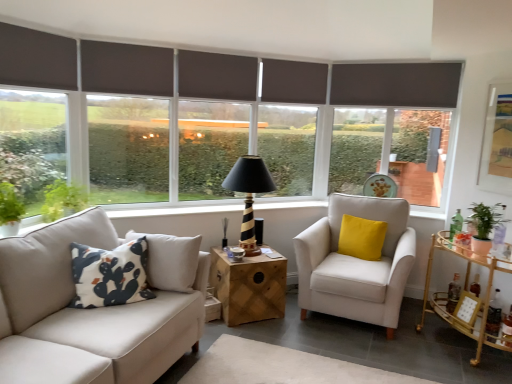
Measure the distance between point (316, 89) and camera.

Point (316, 89) is 4.07 meters away from camera.

Where is `black striped wood table lamp at center`? This screenshot has width=512, height=384. black striped wood table lamp at center is located at coordinates (249, 194).

How much space does matte gray roller blind at center, the fourth window in the left-to-right sequence, occupy vertically?

The height of matte gray roller blind at center, the fourth window in the left-to-right sequence, is 4.42 feet.

The width and height of the screenshot is (512, 384). What are the coordinates of `dark gray matte shutter at upper center, acting as the 1th shutter starting from the right` in the screenshot? It's located at (294, 82).

Is dark gray roller blind at left, the 2th window from the left, inside or outside of dark gray matte shutter at upper center, the 4th shutter when ordered from front to back?

dark gray roller blind at left, the 2th window from the left, cannot be found inside dark gray matte shutter at upper center, the 4th shutter when ordered from front to back.

From a real-world perspective, between dark gray roller blind at left, the third window positioned from the right, and dark gray matte shutter at upper center, the 4th shutter when ordered from front to back, who is vertically lower?

dark gray roller blind at left, the third window positioned from the right, is physically lower.

Does dark gray roller blind at left, the 2th window from the left, have a greater height compared to dark gray matte shutter at upper center, acting as the 1th shutter starting from the back?

Yes.

From the image's perspective, is dark gray roller blind at left, the third window positioned from the right, located beneath dark gray matte shutter at upper center, the 4th shutter when ordered from front to back?

Correct, dark gray roller blind at left, the third window positioned from the right, appears lower than dark gray matte shutter at upper center, the 4th shutter when ordered from front to back, in the image.

From the picture: How much distance is there between beige fabric armchair at center and matte gray roller blind at center, acting as the first window starting from the right?

beige fabric armchair at center is 1.49 meters from matte gray roller blind at center, acting as the first window starting from the right.

How different are the orientations of beige fabric armchair at center and matte gray roller blind at center, the fourth window in the left-to-right sequence, in degrees?

The angle between the facing direction of beige fabric armchair at center and the facing direction of matte gray roller blind at center, the fourth window in the left-to-right sequence, is 46 degrees.

Find the location of a particular element. This screenshot has height=384, width=512. chair lying in front of the matte gray roller blind at center, the fourth window in the left-to-right sequence is located at coordinates (356, 263).

From the image's perspective, which is above, beige fabric armchair at center or matte gray roller blind at center, the fourth window in the left-to-right sequence?

matte gray roller blind at center, the fourth window in the left-to-right sequence, from the image's perspective.

Who is taller, beige fabric armchair at center or dark gray matte shutter at upper center, the 4th shutter when ordered from front to back?

beige fabric armchair at center is taller.

How distant is beige fabric armchair at center from dark gray matte shutter at upper center, the 4th shutter when ordered from front to back?

They are 1.41 meters apart.

Who is more distant, beige fabric armchair at center or dark gray matte shutter at upper center, the 4th shutter when ordered from front to back?

dark gray matte shutter at upper center, the 4th shutter when ordered from front to back, is behind.

In terms of width, does beige fabric armchair at center look wider or thinner when compared to dark gray matte shutter at upper center, acting as the 1th shutter starting from the back?

Clearly, beige fabric armchair at center has more width compared to dark gray matte shutter at upper center, acting as the 1th shutter starting from the back.

How many degrees apart are the facing directions of dark gray printed cushion at left, marked as the 1th pillow in a left-to-right arrangement, and matte gray roller blind at center, the fourth window in the left-to-right sequence?

The angle between the facing direction of dark gray printed cushion at left, marked as the 1th pillow in a left-to-right arrangement, and the facing direction of matte gray roller blind at center, the fourth window in the left-to-right sequence, is 6.61 degrees.

Is dark gray printed cushion at left, marked as the 1th pillow in a left-to-right arrangement, facing away from matte gray roller blind at center, acting as the first window starting from the right?

No.

Starting from the dark gray printed cushion at left, which ranks as the 2th pillow in right-to-left order, which window is the 2nd one to the right? Please provide its 2D coordinates.

[(288, 147)]

Is dark gray printed cushion at left, which is counted as the second pillow, starting from the back, to the right of matte gray roller blind at center, the fourth window in the left-to-right sequence, from the viewer's perspective?

No, dark gray printed cushion at left, which is counted as the second pillow, starting from the back, is not to the right of matte gray roller blind at center, the fourth window in the left-to-right sequence.

Does beige fabric armchair at center appear on the left side of dark gray matte shutter at upper center, marked as the second shutter in a left-to-right arrangement?

No.

From the image's perspective, would you say beige fabric armchair at center is positioned over dark gray matte shutter at upper center, the 2th shutter positioned from the front?

No, from the image's perspective, beige fabric armchair at center is not on top of dark gray matte shutter at upper center, the 2th shutter positioned from the front.

From the picture: Could you tell me if beige fabric armchair at center is facing dark gray matte shutter at upper center, marked as the second shutter in a left-to-right arrangement?

No, beige fabric armchair at center is not aimed at dark gray matte shutter at upper center, marked as the second shutter in a left-to-right arrangement.

From a real-world perspective, is black striped wood table lamp at center below dark gray matte shutter at upper center, acting as the 1th shutter starting from the right?

Yes, from a real-world perspective, black striped wood table lamp at center is under dark gray matte shutter at upper center, acting as the 1th shutter starting from the right.

Looking at this image, could dark gray matte shutter at upper center, the 4th shutter when ordered from front to back, be considered to be inside black striped wood table lamp at center?

Definitely not — dark gray matte shutter at upper center, the 4th shutter when ordered from front to back, is not inside black striped wood table lamp at center.

Based on their positions, is black striped wood table lamp at center located to the left or right of dark gray matte shutter at upper center, acting as the 1th shutter starting from the back?

black striped wood table lamp at center is to the left of dark gray matte shutter at upper center, acting as the 1th shutter starting from the back.

Is there a large distance between black striped wood table lamp at center and dark gray matte shutter at upper center, arranged as the fourth shutter when viewed from the left?

Indeed, black striped wood table lamp at center is not near dark gray matte shutter at upper center, arranged as the fourth shutter when viewed from the left.

How many degrees apart are the facing directions of dark gray roller blind at left, which is the 4th window from right to left, and gold metallic bar cart at right, which is the first table from right to left?

134 degrees separate the facing orientations of dark gray roller blind at left, which is the 4th window from right to left, and gold metallic bar cart at right, which is the first table from right to left.

Based on the photo, from a real-world perspective, which object stands above the other?

dark gray roller blind at left, the first window positioned from the left.

Is gold metallic bar cart at right, which is the first table from right to left, completely or partially inside dark gray roller blind at left, which is the 4th window from right to left?

That's incorrect, gold metallic bar cart at right, which is the first table from right to left, is not inside dark gray roller blind at left, which is the 4th window from right to left.

Does dark gray roller blind at left, the first window positioned from the left, appear on the right side of gold metallic bar cart at right, placed as the second table when sorted from left to right?

No.

Which window is the 3rd one when counting from the left side of the dark gray matte shutter at upper center, arranged as the fourth shutter when viewed from the left? Please provide its 2D coordinates.

[(128, 149)]

Where is `chair in front of the matte gray roller blind at center, acting as the first window starting from the right`? chair in front of the matte gray roller blind at center, acting as the first window starting from the right is located at coordinates [x=356, y=263].

Which object lies further to the anchor point dark gray printed cushion at left, which is counted as the second pillow, starting from the back, wooden cube at center, which appears as the first table when viewed from the left, or brown fabric shutter at upper center, acting as the second shutter starting from the right?

brown fabric shutter at upper center, acting as the second shutter starting from the right.

Considering their positions, is dark gray printed cushion at left, which ranks as the 2th pillow in right-to-left order, positioned closer to beige fabric armchair at center than velvet yellow pillow at right, marked as the first pillow in a right-to-left arrangement?

velvet yellow pillow at right, marked as the first pillow in a right-to-left arrangement, is positioned closer to the anchor beige fabric armchair at center.

Considering their positions, is brown fabric shutter at upper center, acting as the second shutter starting from the right, positioned further to dark gray roller blind at left, the first window positioned from the left, than velvet yellow pillow at right, placed as the 2th pillow when sorted from left to right?

velvet yellow pillow at right, placed as the 2th pillow when sorted from left to right, is further to dark gray roller blind at left, the first window positioned from the left.

Considering their positions, is dark gray printed cushion at left, the 1th pillow positioned from the front, positioned further to beige fabric armchair at center than matte gold-framed artwork at upper right?

Based on the image, dark gray printed cushion at left, the 1th pillow positioned from the front, appears to be further to beige fabric armchair at center.

Considering their positions, is matte gray roller blind at center, acting as the first window starting from the right, positioned closer to beige fabric armchair at center than dark gray matte shutter at upper center, the 3th shutter positioned from the right?

Based on the image, matte gray roller blind at center, acting as the first window starting from the right, appears to be nearer to beige fabric armchair at center.

When comparing their distances from dark gray roller blind at left, the 2th window from the left, does wooden cube at center, which appears as the first table when viewed from the left, or dark gray fabric at upper left, which appears as the 4th shutter when viewed from the back, seem further?

wooden cube at center, which appears as the first table when viewed from the left, lies further to dark gray roller blind at left, the 2th window from the left, than the other object.

Considering their positions, is dark gray printed cushion at left, the 1th pillow positioned from the front, positioned further to dark gray roller blind at left, the third window positioned from the right, than gold metallic bar cart at right, which is the first table from right to left?

gold metallic bar cart at right, which is the first table from right to left, is positioned further to the anchor dark gray roller blind at left, the third window positioned from the right.

Which object lies nearer to the anchor point dark gray roller blind at left, the 2th window from the left, dark gray matte shutter at upper center, the 2th shutter positioned from the front, or dark gray roller blind at left, the first window positioned from the left?

dark gray matte shutter at upper center, the 2th shutter positioned from the front, lies closer to dark gray roller blind at left, the 2th window from the left, than the other object.

The width and height of the screenshot is (512, 384). What are the coordinates of `window between dark gray roller blind at left, the 2th window from the left, and brown fabric shutter at upper center, placed as the third shutter when sorted from front to back, from left to right` in the screenshot? It's located at (209, 146).

The width and height of the screenshot is (512, 384). Find the location of `window between black striped wood table lamp at center and gold metallic bar cart at right, placed as the second table when sorted from left to right, in the horizontal direction`. window between black striped wood table lamp at center and gold metallic bar cart at right, placed as the second table when sorted from left to right, in the horizontal direction is located at coordinates (x=288, y=147).

Find the location of a particular element. window located between dark gray roller blind at center, positioned as the 3th window in left-to-right order, and velvet yellow pillow at right, marked as the first pillow in a right-to-left arrangement, in the left-right direction is located at coordinates (288, 147).

Image resolution: width=512 pixels, height=384 pixels. I want to click on pillow located between dark gray roller blind at left, the 2th window from the left, and matte gray roller blind at center, the fourth window in the left-to-right sequence, in the left-right direction, so click(x=110, y=274).